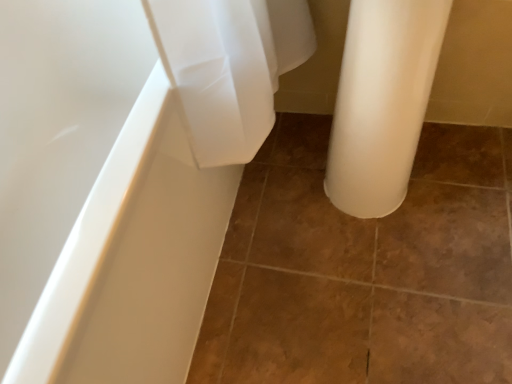
Question: Could brown matte tile at center be considered to be inside matte white bathtub at left?

Choices:
 (A) yes
 (B) no

Answer: (B)

Question: Is matte white bathtub at left touching brown matte tile at center?

Choices:
 (A) yes
 (B) no

Answer: (B)

Question: Does matte white bathtub at left have a larger size compared to brown matte tile at center?

Choices:
 (A) yes
 (B) no

Answer: (A)

Question: Is matte white bathtub at left outside brown matte tile at center?

Choices:
 (A) no
 (B) yes

Answer: (B)

Question: From the image's perspective, is matte white bathtub at left below brown matte tile at center?

Choices:
 (A) yes
 (B) no

Answer: (B)

Question: From a real-world perspective, is matte white bathtub at left over brown matte tile at center?

Choices:
 (A) no
 (B) yes

Answer: (B)

Question: Is brown matte tile at center to the right of matte white bathtub at left from the viewer's perspective?

Choices:
 (A) no
 (B) yes

Answer: (B)

Question: Is brown matte tile at center aimed at matte white bathtub at left?

Choices:
 (A) no
 (B) yes

Answer: (A)

Question: Is brown matte tile at center taller than matte white bathtub at left?

Choices:
 (A) yes
 (B) no

Answer: (B)

Question: Is brown matte tile at center wider than matte white bathtub at left?

Choices:
 (A) yes
 (B) no

Answer: (A)

Question: Is the position of brown matte tile at center less distant than that of matte white bathtub at left?

Choices:
 (A) yes
 (B) no

Answer: (B)

Question: Does brown matte tile at center have a lesser height compared to matte white bathtub at left?

Choices:
 (A) no
 (B) yes

Answer: (B)

Question: Is matte white bathtub at left inside or outside of brown matte tile at center?

Choices:
 (A) inside
 (B) outside

Answer: (B)